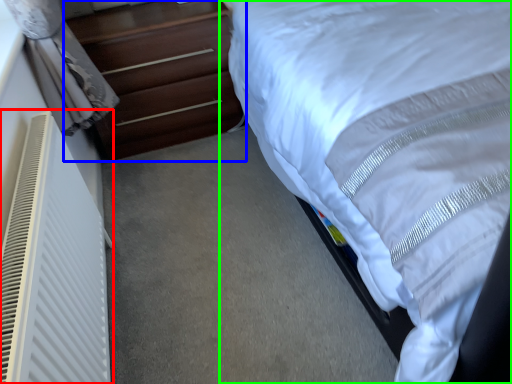
Question: Which object is positioned closest to air conditioner (highlighted by a red box)? Select from chest of drawers (highlighted by a blue box) and bed (highlighted by a green box).

Choices:
 (A) chest of drawers
 (B) bed

Answer: (B)